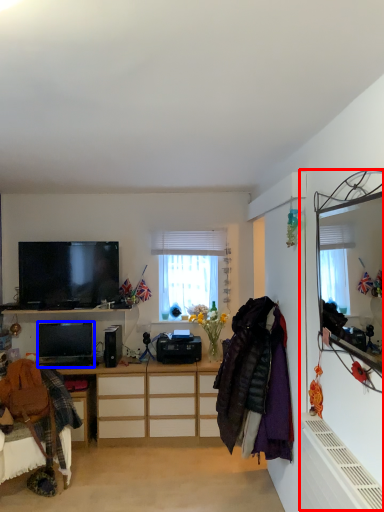
Question: Which object appears closest to the camera in this image, side (highlighted by a red box) or desktop computer (highlighted by a blue box)?

Choices:
 (A) side
 (B) desktop computer

Answer: (A)